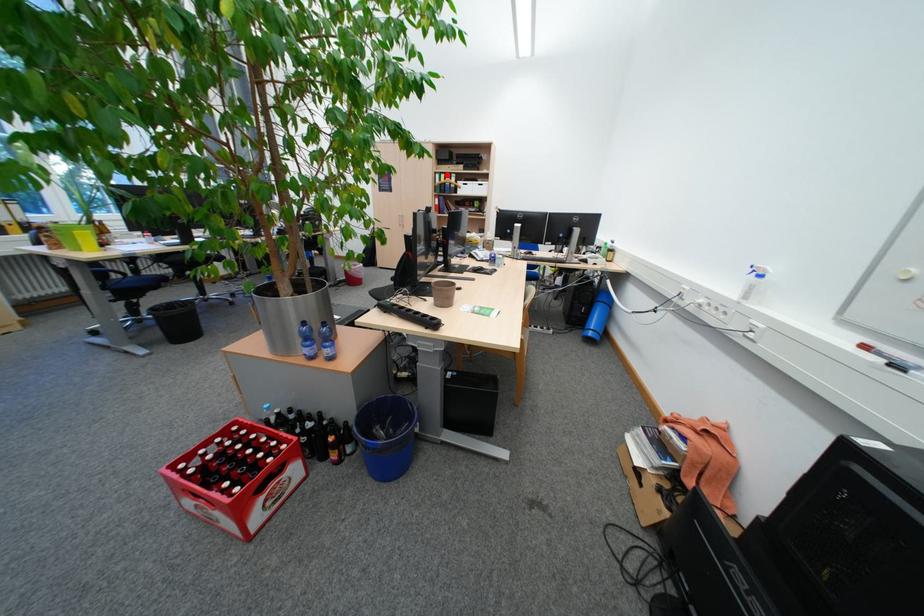
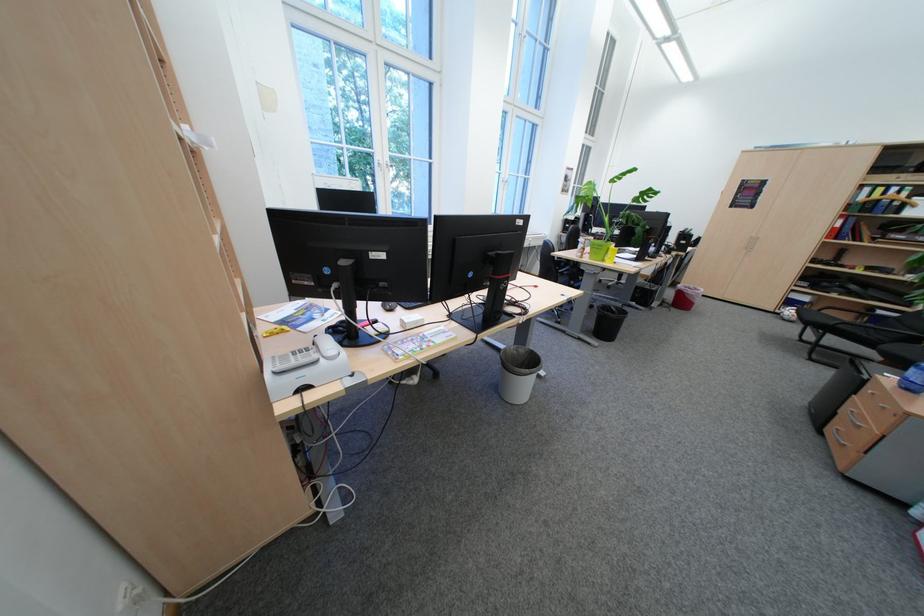
The point at the highlighted location is marked in the first image. Where is the corresponding point in the second image?

(873, 188)